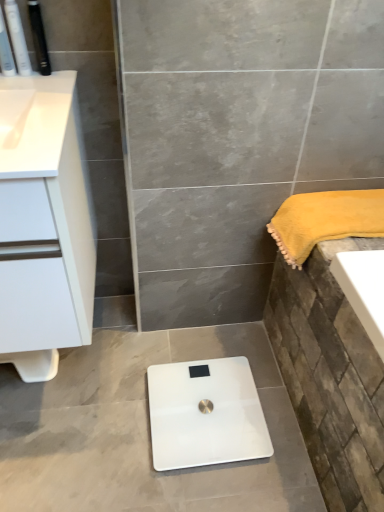
Identify the location of free space in front of black plastic toothbrush at upper left, acting as the 1th toiletry starting from the right. (43, 92).